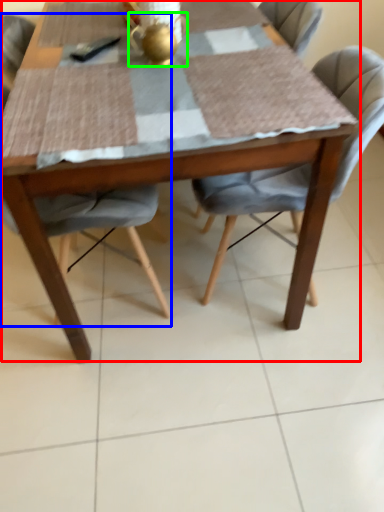
Question: Which object is positioned farthest from kitchen & dining room table (highlighted by a red box)? Select from chair (highlighted by a blue box) and tea pot (highlighted by a green box).

Choices:
 (A) chair
 (B) tea pot

Answer: (A)